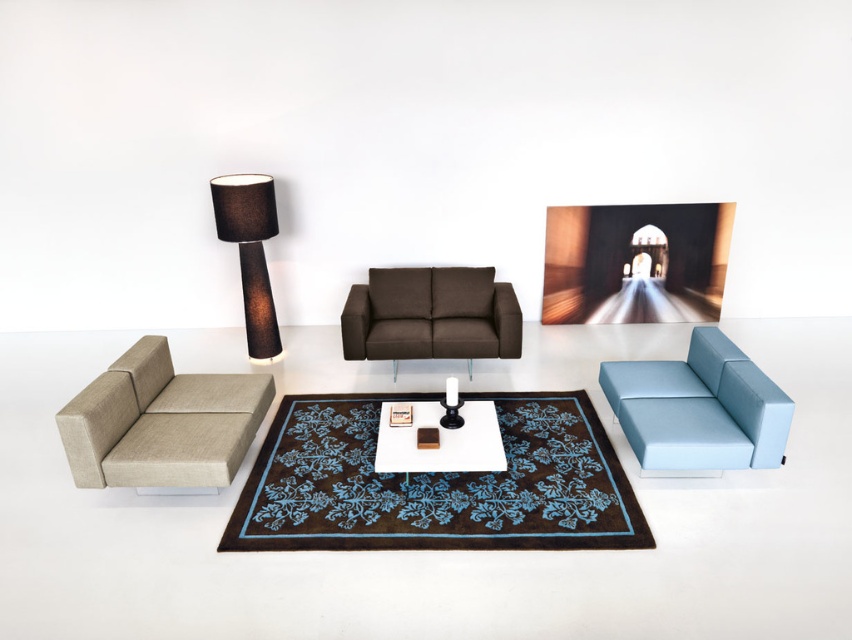
Is point (744, 449) positioned before point (448, 332)?

Yes, it is.

Between light blue fabric armchair at right and matte brown fabric couch at center, which one appears on the left side from the viewer's perspective?

matte brown fabric couch at center is more to the left.

This screenshot has height=640, width=852. In order to click on light blue fabric armchair at right in this screenshot , I will do `click(699, 408)`.

The image size is (852, 640). In order to click on light blue fabric armchair at right in this screenshot , I will do `click(699, 408)`.

In the scene shown: Who is higher up, black fabric lamp at upper left or white glossy table at center?

black fabric lamp at upper left is higher up.

Which is more to the left, black fabric lamp at upper left or white glossy table at center?

black fabric lamp at upper left is more to the left.

Is point (235, 211) closer to camera compared to point (404, 468)?

No.

Image resolution: width=852 pixels, height=640 pixels. Find the location of `black fabric lamp at upper left`. black fabric lamp at upper left is located at coordinates (250, 252).

Can you confirm if light blue fabric armchair at right is positioned below black fabric lamp at upper left?

Yes, light blue fabric armchair at right is below black fabric lamp at upper left.

Can you confirm if light blue fabric armchair at right is smaller than black fabric lamp at upper left?

No, light blue fabric armchair at right is not smaller than black fabric lamp at upper left.

Where is `light blue fabric armchair at right`? light blue fabric armchair at right is located at coordinates (699, 408).

Identify the location of light blue fabric armchair at right. (699, 408).